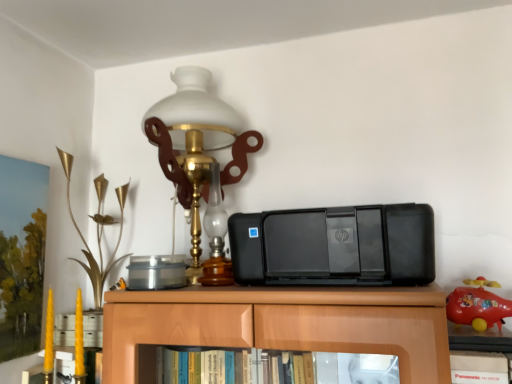
Question: From a real-world perspective, is rubberized red toy airplane at right, the second toy viewed from the left, located higher than black plastic printer at center?

Choices:
 (A) yes
 (B) no

Answer: (B)

Question: Does rubberized red toy airplane at right, the second toy viewed from the left, touch black plastic printer at center?

Choices:
 (A) yes
 (B) no

Answer: (B)

Question: Is rubberized red toy airplane at right, marked as the 1th toy in a front-to-back arrangement, bigger than black plastic printer at center?

Choices:
 (A) no
 (B) yes

Answer: (A)

Question: Does rubberized red toy airplane at right, marked as the 2th toy in a back-to-front arrangement, have a greater height compared to black plastic printer at center?

Choices:
 (A) no
 (B) yes

Answer: (A)

Question: From the image's perspective, is rubberized red toy airplane at right, which ranks as the 1th toy in right-to-left order, below black plastic printer at center?

Choices:
 (A) yes
 (B) no

Answer: (A)

Question: Relative to black plastic book at lower right, is gold metallic flower at left, marked as the first toy in a back-to-front arrangement, in front or behind?

Choices:
 (A) behind
 (B) front

Answer: (A)

Question: In terms of height, does gold metallic flower at left, which appears as the 2th toy when viewed from the front, look taller or shorter compared to black plastic book at lower right?

Choices:
 (A) short
 (B) tall

Answer: (B)

Question: Does point (98, 289) appear closer or farther from the camera than point (490, 379)?

Choices:
 (A) farther
 (B) closer

Answer: (A)

Question: Choose the correct answer: Is gold metallic flower at left, marked as the first toy in a left-to-right arrangement, inside black plastic book at lower right or outside it?

Choices:
 (A) inside
 (B) outside

Answer: (B)

Question: From the image's perspective, relative to black plastic printer at center, is gold metallic flower at left, the 2th toy from the right, above or below?

Choices:
 (A) below
 (B) above

Answer: (A)

Question: Is gold metallic flower at left, which appears as the 2th toy when viewed from the front, wider or thinner than black plastic printer at center?

Choices:
 (A) thin
 (B) wide

Answer: (A)

Question: Considering their positions, is gold metallic flower at left, marked as the first toy in a back-to-front arrangement, located in front of or behind black plastic printer at center?

Choices:
 (A) behind
 (B) front

Answer: (A)

Question: Is gold metallic flower at left, marked as the first toy in a left-to-right arrangement, inside or outside of black plastic printer at center?

Choices:
 (A) outside
 (B) inside

Answer: (A)

Question: Looking at the image, does matte glass lamp at upper center seem bigger or smaller compared to gold metallic flower at left, marked as the first toy in a back-to-front arrangement?

Choices:
 (A) small
 (B) big

Answer: (B)

Question: From a real-world perspective, is matte glass lamp at upper center above or below gold metallic flower at left, marked as the first toy in a back-to-front arrangement?

Choices:
 (A) below
 (B) above

Answer: (B)